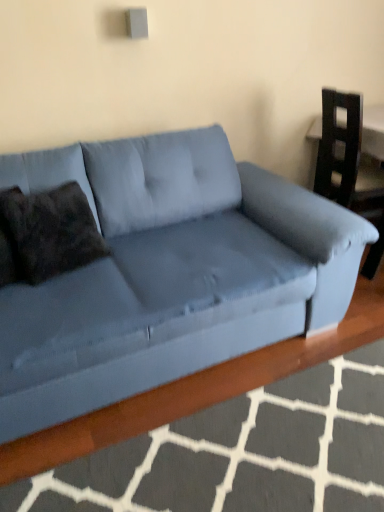
Question: From a real-world perspective, is velvet blue couch at center positioned under dark brown textured pillow at left based on gravity?

Choices:
 (A) no
 (B) yes

Answer: (B)

Question: Is velvet blue couch at center to the right of dark brown textured pillow at left from the viewer's perspective?

Choices:
 (A) no
 (B) yes

Answer: (B)

Question: Is there a large distance between velvet blue couch at center and dark brown textured pillow at left?

Choices:
 (A) no
 (B) yes

Answer: (A)

Question: Is velvet blue couch at center thinner than dark brown textured pillow at left?

Choices:
 (A) no
 (B) yes

Answer: (A)

Question: Does velvet blue couch at center appear on the left side of dark brown textured pillow at left?

Choices:
 (A) yes
 (B) no

Answer: (B)

Question: From a real-world perspective, relative to matte blue armchair at right, is dark brown textured pillow at left vertically above or below?

Choices:
 (A) below
 (B) above

Answer: (B)

Question: From the image's perspective, is dark brown textured pillow at left positioned above or below matte blue armchair at right?

Choices:
 (A) below
 (B) above

Answer: (A)

Question: Is point (69, 258) positioned closer to the camera than point (334, 155)?

Choices:
 (A) closer
 (B) farther

Answer: (A)

Question: Looking at the image, does dark brown textured pillow at left seem bigger or smaller compared to matte blue armchair at right?

Choices:
 (A) big
 (B) small

Answer: (B)

Question: Relative to velvet blue couch at center, is matte blue armchair at right in front or behind?

Choices:
 (A) front
 (B) behind

Answer: (B)

Question: Considering the positions of matte blue armchair at right and velvet blue couch at center in the image, is matte blue armchair at right taller or shorter than velvet blue couch at center?

Choices:
 (A) short
 (B) tall

Answer: (A)

Question: Based on their positions, is matte blue armchair at right located to the left or right of velvet blue couch at center?

Choices:
 (A) right
 (B) left

Answer: (A)

Question: From the image's perspective, relative to velvet blue couch at center, is matte blue armchair at right above or below?

Choices:
 (A) above
 (B) below

Answer: (A)

Question: From the image's perspective, is velvet blue couch at center located above or below matte blue armchair at right?

Choices:
 (A) above
 (B) below

Answer: (B)

Question: Does point (104, 328) appear closer or farther from the camera than point (360, 135)?

Choices:
 (A) closer
 (B) farther

Answer: (A)